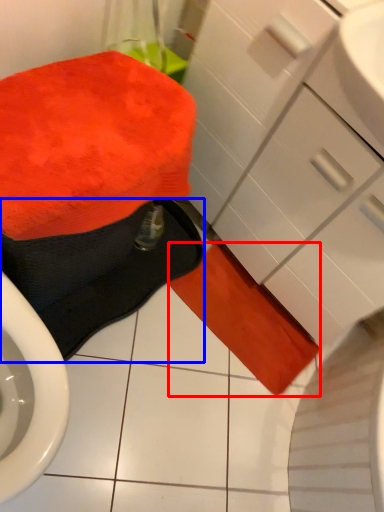
Question: Which of the following is the closest to the observer, bath towel (highlighted by a red box) or bath towel (highlighted by a blue box)?

Choices:
 (A) bath towel
 (B) bath towel

Answer: (B)